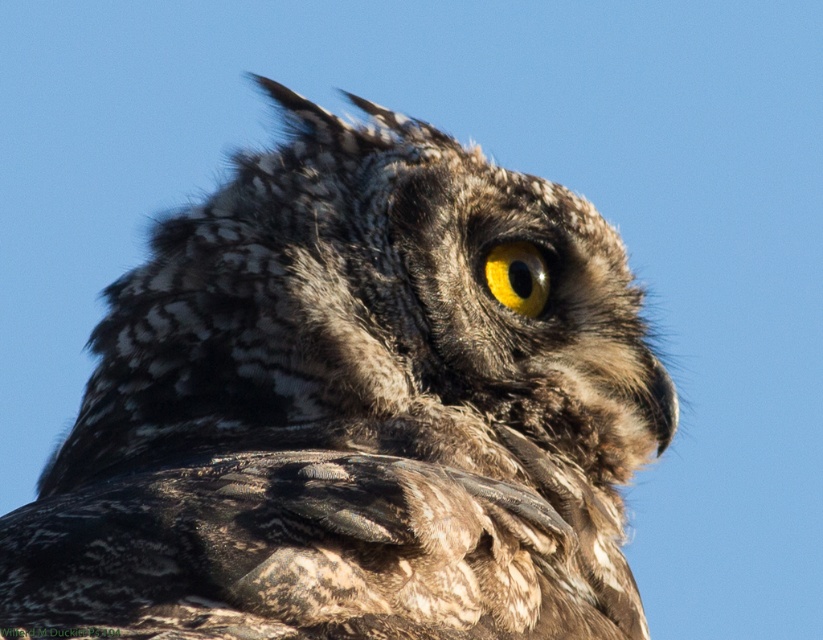
You are an ornithologist observing an owl in the wild. You notice the speckled feathered owl at center and the yellow matte eye at center. Which object is taller in the image?

The speckled feathered owl at center is taller than the yellow matte eye at center.

You are a photographer trying to capture the speckled feathered owl at center and the yellow matte eye at center in a single shot. Which object will appear larger in the photo?

The speckled feathered owl at center will appear larger in the photo because it is closer to the viewer than the yellow matte eye at center.

You are an ornithologist observing an owl in the wild. You notice the speckled feathered owl at center and the yellow matte eye at center. Which object is positioned lower in the image?

The speckled feathered owl at center is located below the yellow matte eye at center, so the speckled feathered owl at center is positioned lower in the image.